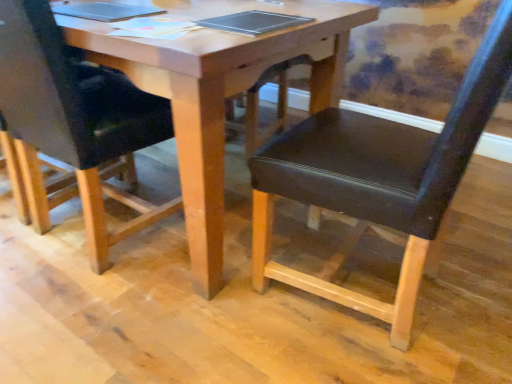
Question: Can you confirm if metallic silver notebook at center is bigger than black leather chair at center, which ranks as the 2th chair in right-to-left order?

Choices:
 (A) yes
 (B) no

Answer: (B)

Question: Does metallic silver notebook at center appear on the left side of black leather chair at center, which ranks as the 2th chair in right-to-left order?

Choices:
 (A) yes
 (B) no

Answer: (B)

Question: From a real-world perspective, is metallic silver notebook at center below black leather chair at center, which ranks as the 2th chair in right-to-left order?

Choices:
 (A) yes
 (B) no

Answer: (B)

Question: Can you see metallic silver notebook at center touching black leather chair at center, acting as the 1th chair starting from the left?

Choices:
 (A) yes
 (B) no

Answer: (B)

Question: From the image's perspective, would you say metallic silver notebook at center is positioned over black leather chair at center, which ranks as the 2th chair in right-to-left order?

Choices:
 (A) no
 (B) yes

Answer: (B)

Question: Is metallic silver notebook at center aimed at black leather chair at center, which ranks as the 2th chair in right-to-left order?

Choices:
 (A) no
 (B) yes

Answer: (B)

Question: Considering the relative sizes of black leather chair at center, acting as the first chair starting from the right, and black leather chair at center, acting as the 1th chair starting from the left, in the image provided, is black leather chair at center, acting as the first chair starting from the right, thinner than black leather chair at center, acting as the 1th chair starting from the left,?

Choices:
 (A) no
 (B) yes

Answer: (B)

Question: From the image's perspective, is black leather chair at center, acting as the first chair starting from the right, located beneath black leather chair at center, acting as the 1th chair starting from the left?

Choices:
 (A) no
 (B) yes

Answer: (B)

Question: Is black leather chair at center, acting as the first chair starting from the right, not close to black leather chair at center, which ranks as the 2th chair in right-to-left order?

Choices:
 (A) no
 (B) yes

Answer: (A)

Question: Is black leather chair at center, marked as the second chair in a left-to-right arrangement, surrounding black leather chair at center, which ranks as the 2th chair in right-to-left order?

Choices:
 (A) yes
 (B) no

Answer: (B)

Question: Does black leather chair at center, marked as the second chair in a left-to-right arrangement, have a smaller size compared to black leather chair at center, acting as the 1th chair starting from the left?

Choices:
 (A) no
 (B) yes

Answer: (B)

Question: Is black leather chair at center, acting as the first chair starting from the right, further to the viewer compared to black leather chair at center, acting as the 1th chair starting from the left?

Choices:
 (A) yes
 (B) no

Answer: (B)

Question: Can you confirm if metallic silver notebook at center is shorter than wooden table at center?

Choices:
 (A) yes
 (B) no

Answer: (A)